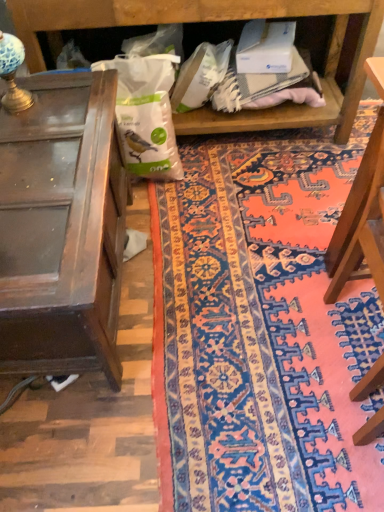
Find the location of a particular element. blank space to the left of wooden chair at right is located at coordinates (265, 348).